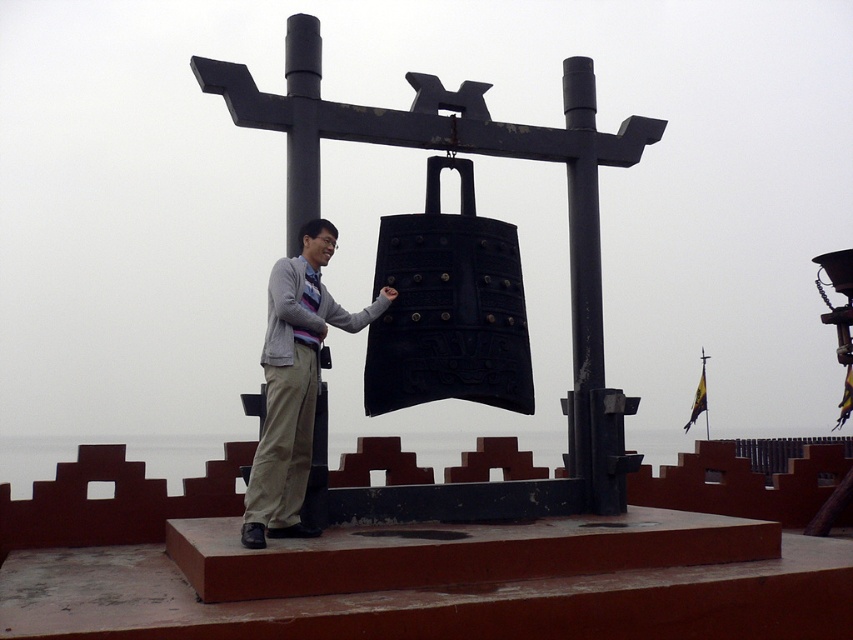
In the scene shown: What are the coordinates of the black metal bell at center?

The coordinates of the black metal bell at center are at point (479,154).

You are designing a display case that needs to accommodate both the black metal bell at center and the light beige pants at center. Based on their sizes, which object requires a wider space in the display case?

The black metal bell at center requires a wider space in the display case because its width is larger than the light beige pants at center.